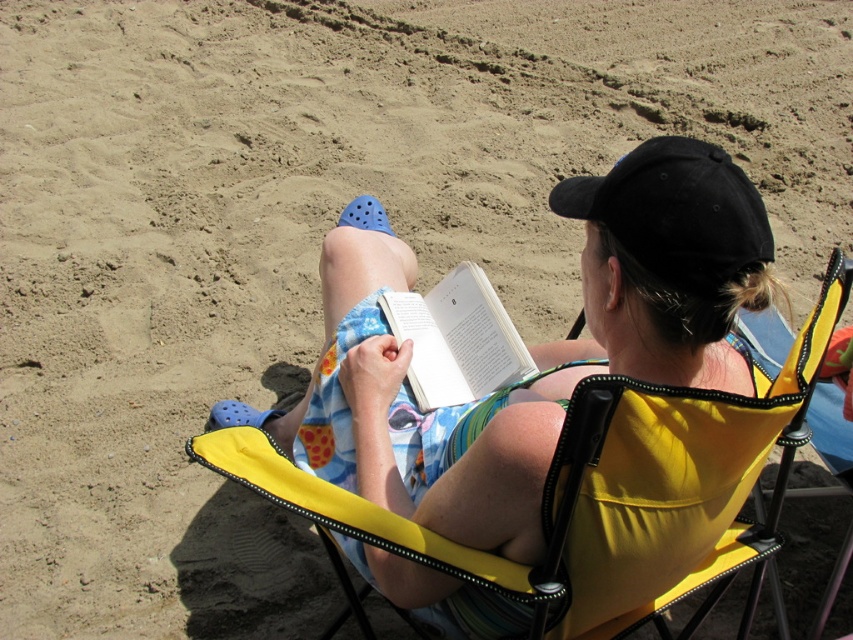
Question: Considering the real-world distances, which object is closest to the floral fabric dress at center?

Choices:
 (A) white paper book at center
 (B) black matte baseball cap at upper right

Answer: (A)

Question: Does floral fabric dress at center have a larger size compared to black matte baseball cap at upper right?

Choices:
 (A) yes
 (B) no

Answer: (A)

Question: Which of the following is the closest to the observer?

Choices:
 (A) floral fabric dress at center
 (B) black matte baseball cap at upper right
 (C) white paper book at center

Answer: (B)

Question: Can you confirm if black matte baseball cap at upper right is wider than white paper book at center?

Choices:
 (A) no
 (B) yes

Answer: (B)

Question: Is floral fabric dress at center below black matte baseball cap at upper right?

Choices:
 (A) yes
 (B) no

Answer: (A)

Question: Which point appears closest to the camera in this image?

Choices:
 (A) (606, 209)
 (B) (395, 324)
 (C) (621, 205)

Answer: (C)